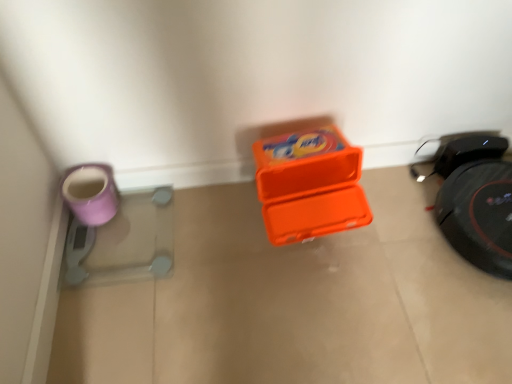
Question: Is matte purple mug at left thinner than orange plastic container at center?

Choices:
 (A) no
 (B) yes

Answer: (B)

Question: Is matte purple mug at left positioned with its back to orange plastic container at center?

Choices:
 (A) no
 (B) yes

Answer: (A)

Question: Is matte purple mug at left far away from orange plastic container at center?

Choices:
 (A) no
 (B) yes

Answer: (A)

Question: Is the depth of matte purple mug at left greater than that of orange plastic container at center?

Choices:
 (A) yes
 (B) no

Answer: (A)

Question: Considering the relative sizes of matte purple mug at left and orange plastic container at center in the image provided, is matte purple mug at left smaller than orange plastic container at center?

Choices:
 (A) yes
 (B) no

Answer: (A)

Question: Is matte purple mug at left at the right side of orange plastic container at center?

Choices:
 (A) yes
 (B) no

Answer: (B)

Question: Is orange plastic container at center thinner than matte purple mug at left?

Choices:
 (A) yes
 (B) no

Answer: (B)

Question: Is orange plastic container at center further to camera compared to matte purple mug at left?

Choices:
 (A) no
 (B) yes

Answer: (A)

Question: Can you confirm if orange plastic container at center is shorter than matte purple mug at left?

Choices:
 (A) yes
 (B) no

Answer: (A)

Question: Considering the relative sizes of orange plastic container at center and matte purple mug at left in the image provided, is orange plastic container at center wider than matte purple mug at left?

Choices:
 (A) no
 (B) yes

Answer: (B)

Question: Is orange plastic container at center touching matte purple mug at left?

Choices:
 (A) no
 (B) yes

Answer: (A)

Question: Does orange plastic container at center have a smaller size compared to matte purple mug at left?

Choices:
 (A) yes
 (B) no

Answer: (B)

Question: From a real-world perspective, is orange plastic container at center physically located above or below matte purple mug at left?

Choices:
 (A) above
 (B) below

Answer: (B)